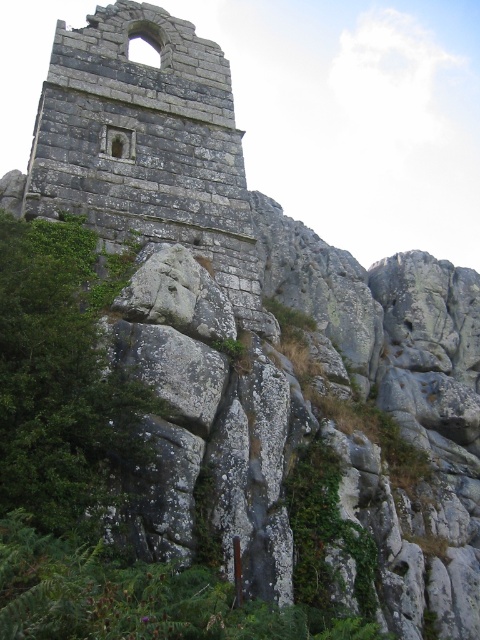
Question: Is rusty stone ruins at center thinner than green leafy tree at lower left?

Choices:
 (A) no
 (B) yes

Answer: (A)

Question: Which of the following is the closest to the observer?

Choices:
 (A) (92, 150)
 (B) (17, 424)

Answer: (B)

Question: Does rusty stone ruins at center have a lesser width compared to green leafy tree at lower left?

Choices:
 (A) no
 (B) yes

Answer: (A)

Question: Does rusty stone ruins at center have a greater width compared to green leafy tree at lower left?

Choices:
 (A) yes
 (B) no

Answer: (A)